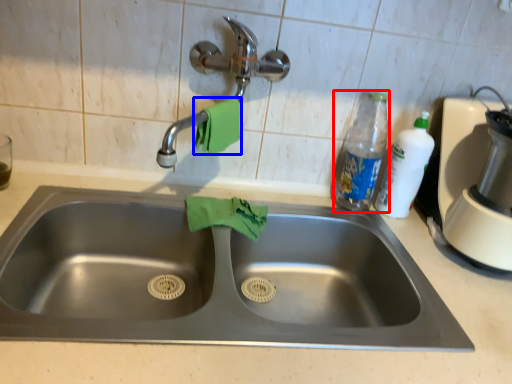
Question: Which point is closer to the camera, bottle (highlighted by a red box) or hand towel (highlighted by a blue box)?

Choices:
 (A) bottle
 (B) hand towel

Answer: (B)